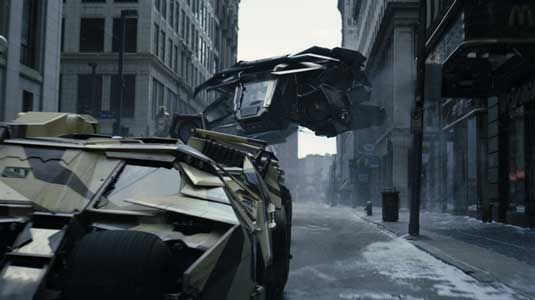
You are a GUI agent. You are given a task and a screenshot of the screen. Output one action in this format:
    pyautogui.click(x=<x>, y=<y>)
    Task: Click on the trashcan
    This screenshot has height=300, width=535.
    Given the screenshot: What is the action you would take?
    pyautogui.click(x=389, y=204)